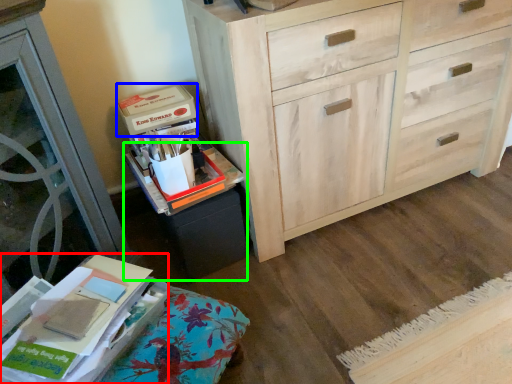
Question: Based on their relative distances, which object is nearer to paperback book (highlighted by a red box)? Choose from storage box (highlighted by a blue box) and cabinetry (highlighted by a green box).

Choices:
 (A) storage box
 (B) cabinetry

Answer: (B)